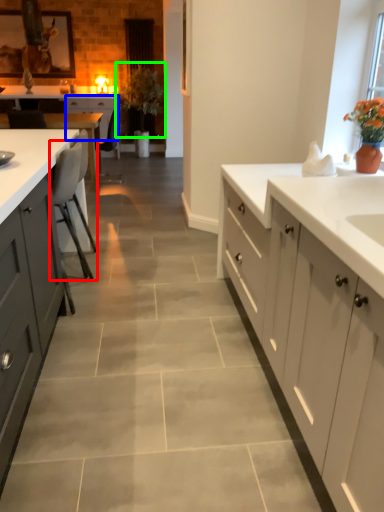
Question: Which is farther away from chair (highlighted by a red box)? cabinetry (highlighted by a blue box) or plant (highlighted by a green box)?

Choices:
 (A) cabinetry
 (B) plant

Answer: (B)